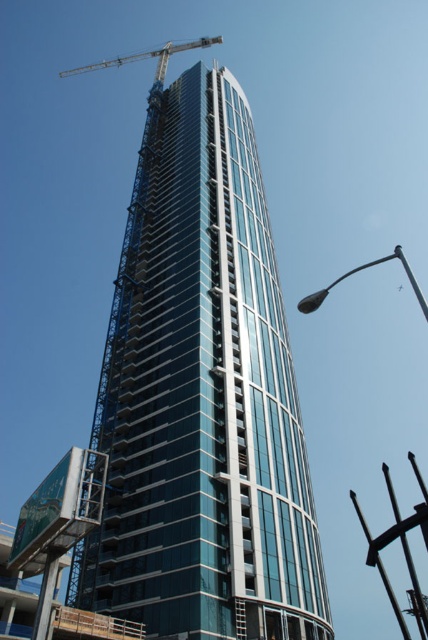
Question: Is glassy steel tower at center further to camera compared to metallic silver crane at top left?

Choices:
 (A) no
 (B) yes

Answer: (A)

Question: Which of the following is the closest to the observer?

Choices:
 (A) (175, 49)
 (B) (285, 481)

Answer: (B)

Question: Which point is closer to the camera?

Choices:
 (A) (86, 67)
 (B) (214, 593)

Answer: (B)

Question: Is the position of glassy steel tower at center more distant than that of metallic silver crane at top left?

Choices:
 (A) yes
 (B) no

Answer: (B)

Question: Where is glassy steel tower at center located in relation to metallic silver crane at top left in the image?

Choices:
 (A) right
 (B) left

Answer: (A)